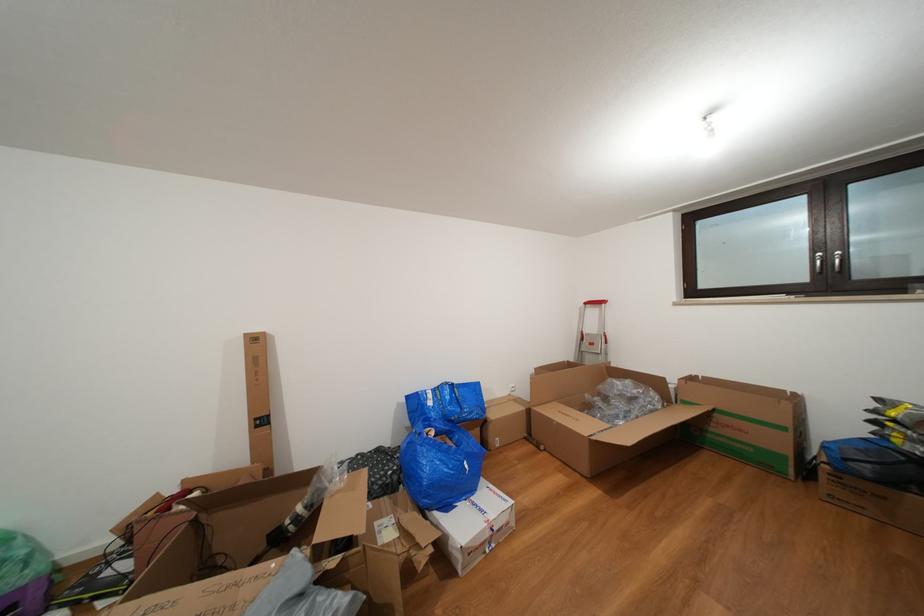
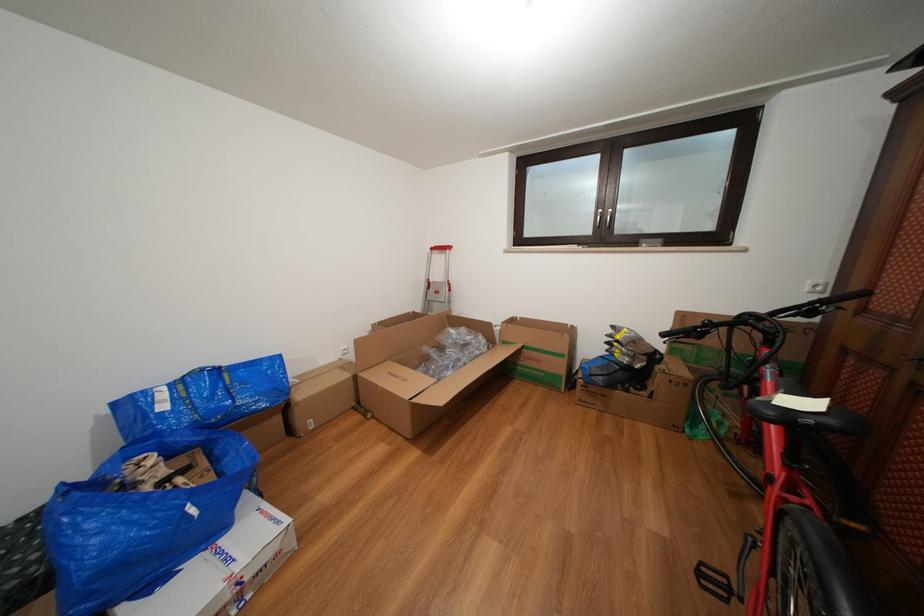
Locate, in the second image, the point that corresponds to (x=791, y=434) in the first image.

(570, 361)